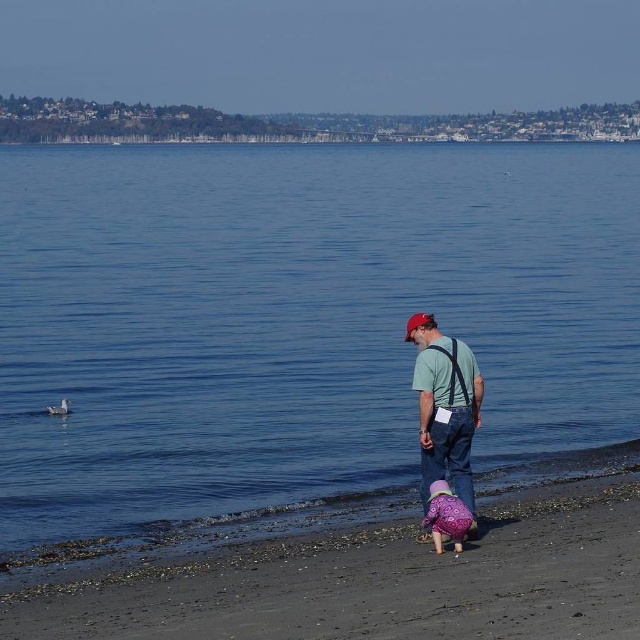
Question: Is blue water at center thinner than purple fuzzy coat at lower center?

Choices:
 (A) yes
 (B) no

Answer: (B)

Question: Is matte green shirt at center wider than purple fuzzy coat at lower center?

Choices:
 (A) yes
 (B) no

Answer: (A)

Question: Considering the real-world distances, which object is farthest from the purple fuzzy coat at lower center?

Choices:
 (A) blue water at center
 (B) matte green shirt at center
 (C) dark brown sandy beach at lower center

Answer: (A)

Question: From the image, what is the correct spatial relationship of blue water at center in relation to matte green shirt at center?

Choices:
 (A) right
 (B) left

Answer: (B)

Question: Among these points, which one is nearest to the camera?

Choices:
 (A) (429, 492)
 (B) (401, 195)
 (C) (419, 317)

Answer: (A)

Question: Which point is closer to the camera taking this photo?

Choices:
 (A) (61, 616)
 (B) (435, 218)
 (C) (449, 348)

Answer: (A)